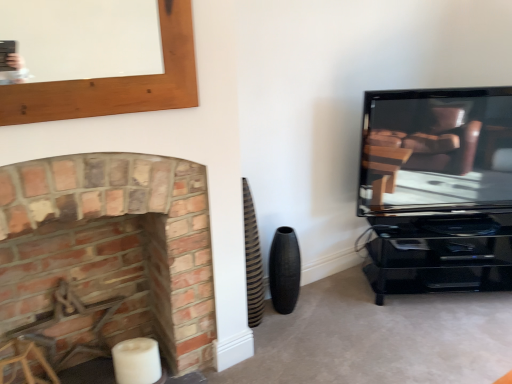
Identify the location of vacant area that is in front of black textured vase at lower center. The height and width of the screenshot is (384, 512). (289, 333).